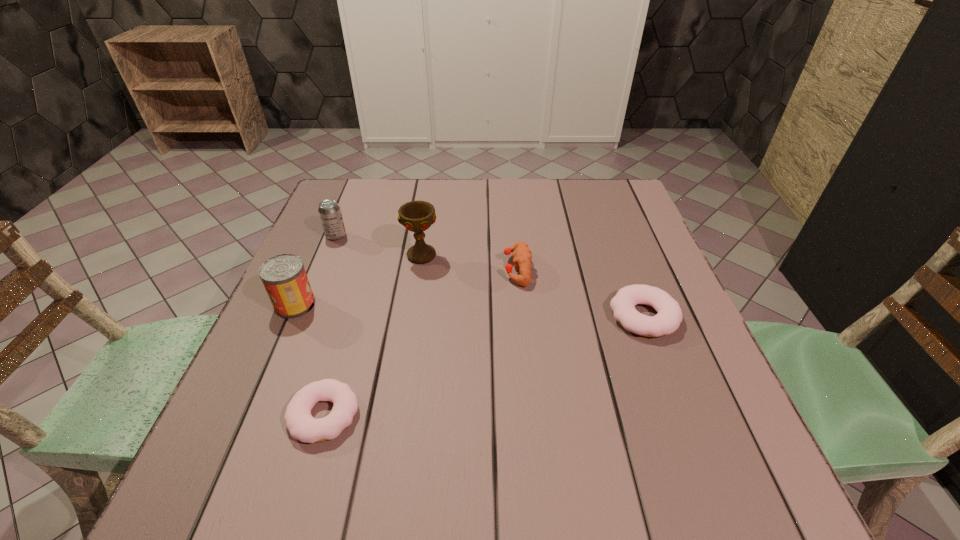
I want to click on vacant space located on the back of the fourth object from right to left, so click(353, 316).

Where is `free space located on the left of the taller doughnut`? free space located on the left of the taller doughnut is located at coordinates pyautogui.click(x=546, y=316).

The image size is (960, 540). Identify the location of vacant space located with the gloves of the third shortest object facing forward. (349, 269).

You are a GUI agent. You are given a task and a screenshot of the screen. Output one action in this format:
    pyautogui.click(x=<x>, y=<y>)
    Task: Click on the vacant area located with the gloves of the third shortest object facing forward
    The width and height of the screenshot is (960, 540).
    Given the screenshot: What is the action you would take?
    pyautogui.click(x=447, y=269)

Identify the location of vacant space located 0.130m with the gloves of the third shortest object facing forward. This screenshot has width=960, height=540. (451, 269).

Image resolution: width=960 pixels, height=540 pixels. Identify the location of vacant space located on the right of the farthest object. (484, 235).

Where is `blank area located on the right of the chalice`? The image size is (960, 540). blank area located on the right of the chalice is located at coordinates (491, 255).

Find the location of a particular element. This screenshot has height=540, width=960. vacant space situated on the right of the can is located at coordinates (469, 304).

Find the location of a particular element. object located at the near edge is located at coordinates click(301, 425).

Find the location of a particular element. doughnut at the left edge is located at coordinates click(301, 425).